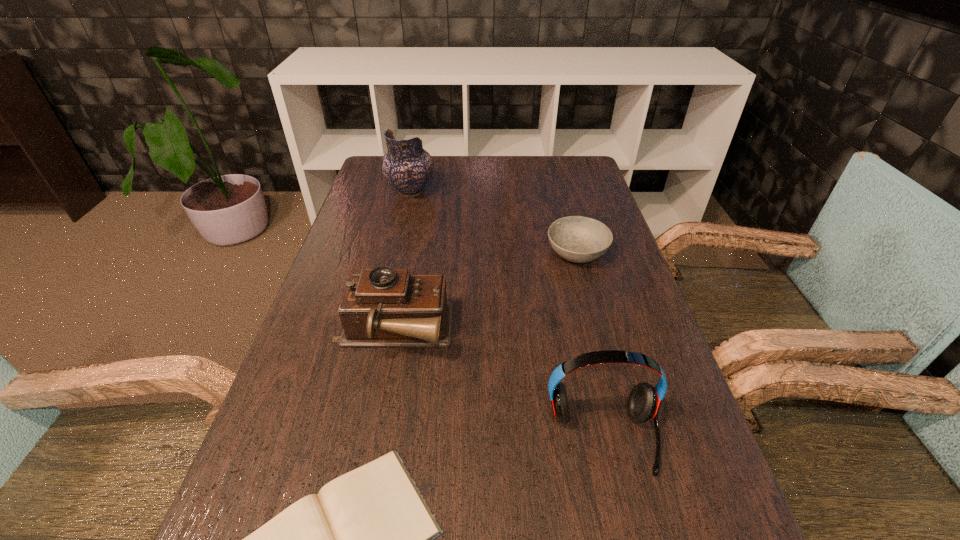
The image size is (960, 540). What are the coordinates of `free spot between the phonograph_record and the headset` in the screenshot? It's located at (497, 385).

Identify the location of free space between the third nearest object and the headset. [497, 385].

You are a GUI agent. You are given a task and a screenshot of the screen. Output one action in this format:
    pyautogui.click(x=<x>, y=<y>)
    Task: Click on the vacant space that's between the bowl and the headset
    The height and width of the screenshot is (540, 960).
    Given the screenshot: What is the action you would take?
    (x=589, y=345)

Find the location of a particular element. free area in between the headset and the fourth tallest object is located at coordinates (589, 345).

This screenshot has width=960, height=540. In order to click on vacant area that lies between the fourth tallest object and the farthest object in this screenshot , I will do `click(493, 222)`.

Where is `free space between the third farthest object and the bowl`? The height and width of the screenshot is (540, 960). free space between the third farthest object and the bowl is located at coordinates (485, 293).

Select which object appears as the third closest to the shortest object. Please provide its 2D coordinates. Your answer should be formatted as a tuple, i.e. [(x, y)], where the tuple contains the x and y coordinates of a point satisfying the conditions above.

[(578, 239)]

Identify which object is the fourth closest to the bowl. Please provide its 2D coordinates. Your answer should be formatted as a tuple, i.e. [(x, y)], where the tuple contains the x and y coordinates of a point satisfying the conditions above.

[(366, 539)]